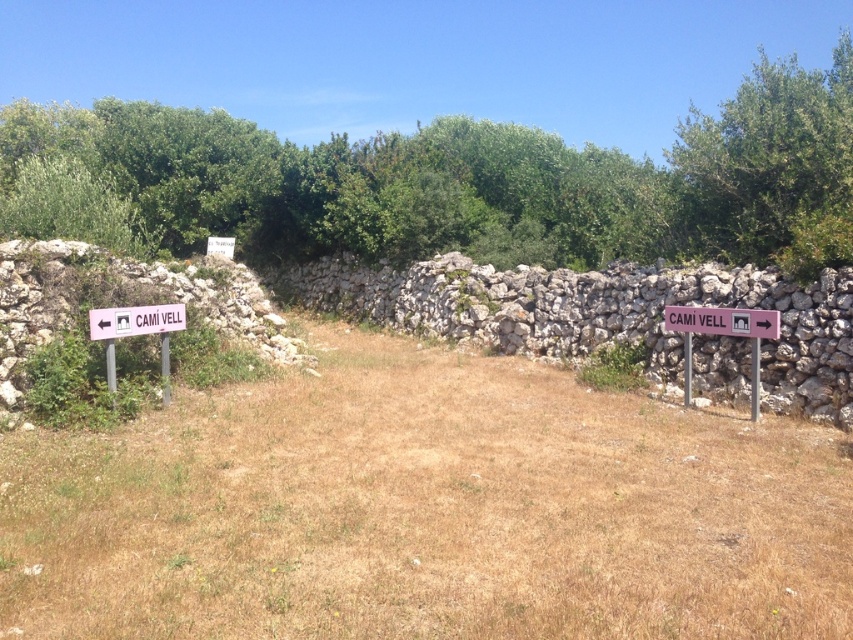
Between pink plastic sign at right and pink plastic sign at left, which one has less height?

With less height is pink plastic sign at right.

Can you confirm if pink plastic sign at right is taller than pink plastic sign at left?

No, pink plastic sign at right is not taller than pink plastic sign at left.

Locate an element on the screen. The height and width of the screenshot is (640, 853). pink plastic sign at right is located at coordinates (723, 321).